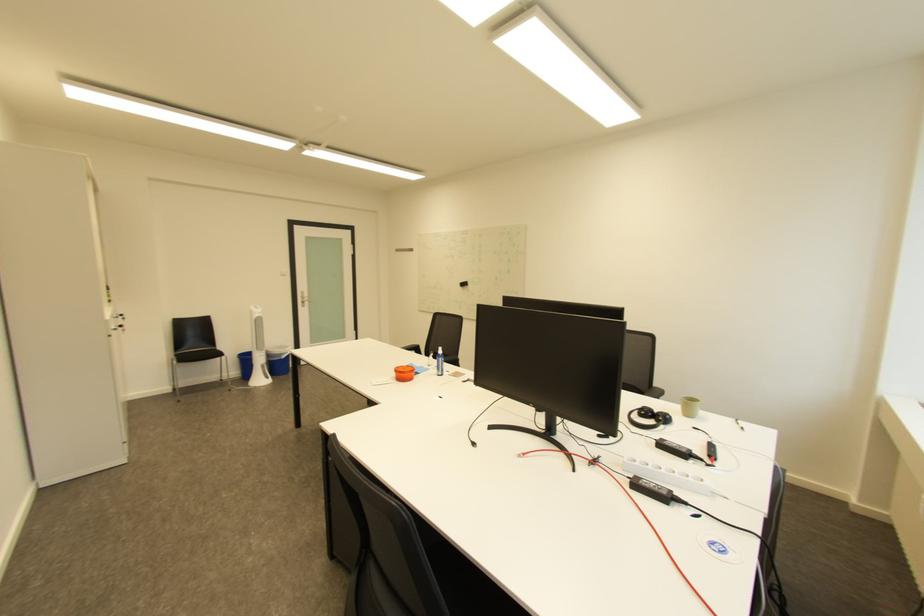
The width and height of the screenshot is (924, 616). What do you see at coordinates (117, 331) in the screenshot? I see `a silver door handle` at bounding box center [117, 331].